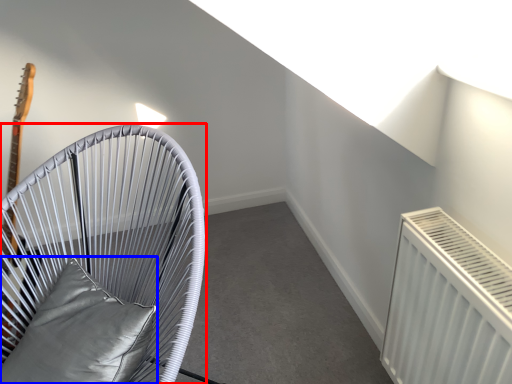
Question: Which object is further to the camera taking this photo, furniture (highlighted by a red box) or pillow (highlighted by a blue box)?

Choices:
 (A) furniture
 (B) pillow

Answer: (B)